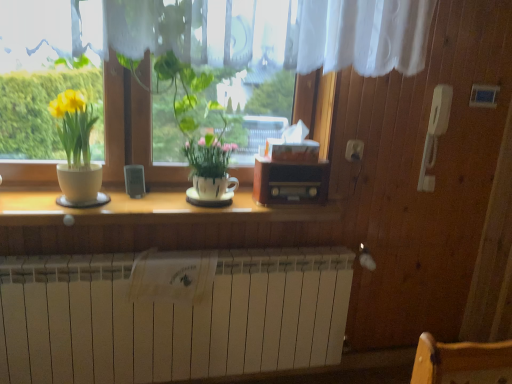
Question: In terms of width, does matte white pot at left, the 2th houseplant viewed from the right, look wider or thinner when compared to wooden radio at center?

Choices:
 (A) wide
 (B) thin

Answer: (A)

Question: From the image's perspective, is matte white pot at left, the 2th houseplant viewed from the right, above or below wooden radio at center?

Choices:
 (A) above
 (B) below

Answer: (A)

Question: Which of these objects is positioned closest to the white matte radiator at lower center?

Choices:
 (A) matte white pot at left, the 1th houseplant when ordered from left to right
 (B) wooden counter top at center
 (C) wooden radio at center
 (D) white glossy pot at center, which ranks as the 2th houseplant in left-to-right order

Answer: (B)

Question: Which of these objects is positioned closest to the white matte radiator at lower center?

Choices:
 (A) wooden counter top at center
 (B) wooden radio at center
 (C) white glossy pot at center, marked as the 1th houseplant in a right-to-left arrangement
 (D) matte white pot at left, the 1th houseplant when ordered from left to right

Answer: (A)